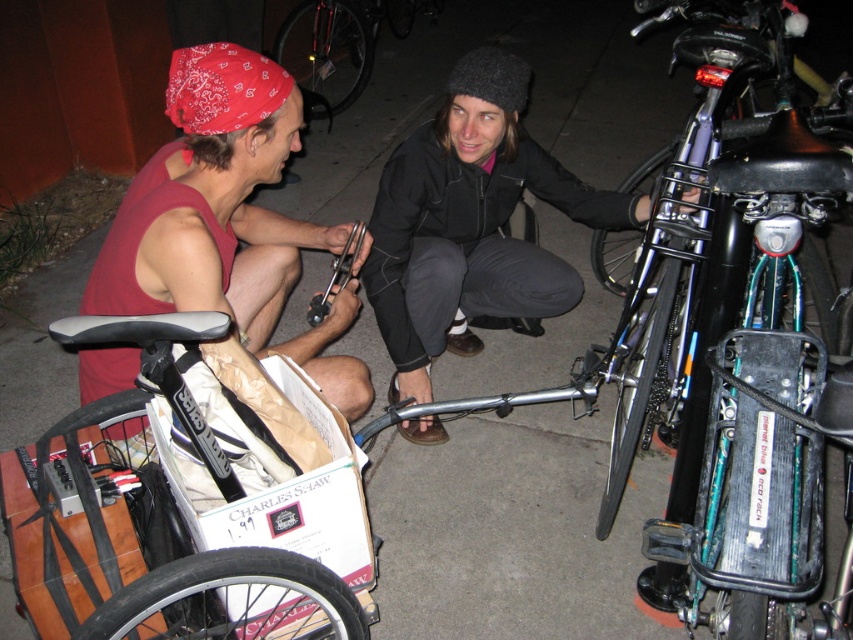
Does wooden bicycle at lower left have a lesser height compared to matte red bandana at left?

Yes.

Is wooden bicycle at lower left to the left of matte red bandana at left from the viewer's perspective?

Yes, wooden bicycle at lower left is to the left of matte red bandana at left.

Which is in front, point (171, 396) or point (158, 289)?

Point (171, 396)

Locate an element on the screen. wooden bicycle at lower left is located at coordinates (186, 500).

Can you confirm if matte red bandana at left is taller than black matte bicycle at center?

Incorrect, matte red bandana at left's height is not larger of black matte bicycle at center's.

Measure the distance between matte red bandana at left and camera.

matte red bandana at left and camera are 1.63 meters apart from each other.

Where is `matte red bandana at left`? matte red bandana at left is located at coordinates (227, 220).

This screenshot has width=853, height=640. What are the coordinates of `matte red bandana at left` in the screenshot? It's located at (227, 220).

Which is more to the left, wooden bicycle at lower left or black matte bicycle at center?

From the viewer's perspective, wooden bicycle at lower left appears more on the left side.

Which is above, wooden bicycle at lower left or black matte bicycle at center?

Positioned higher is black matte bicycle at center.

The width and height of the screenshot is (853, 640). Find the location of `wooden bicycle at lower left`. wooden bicycle at lower left is located at coordinates (186, 500).